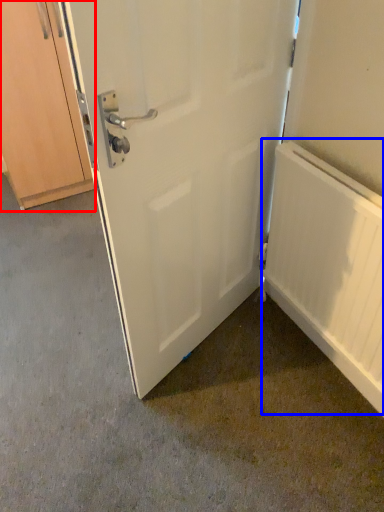
Question: Which object is further to the camera taking this photo, cabinetry (highlighted by a red box) or radiator (highlighted by a blue box)?

Choices:
 (A) cabinetry
 (B) radiator

Answer: (A)